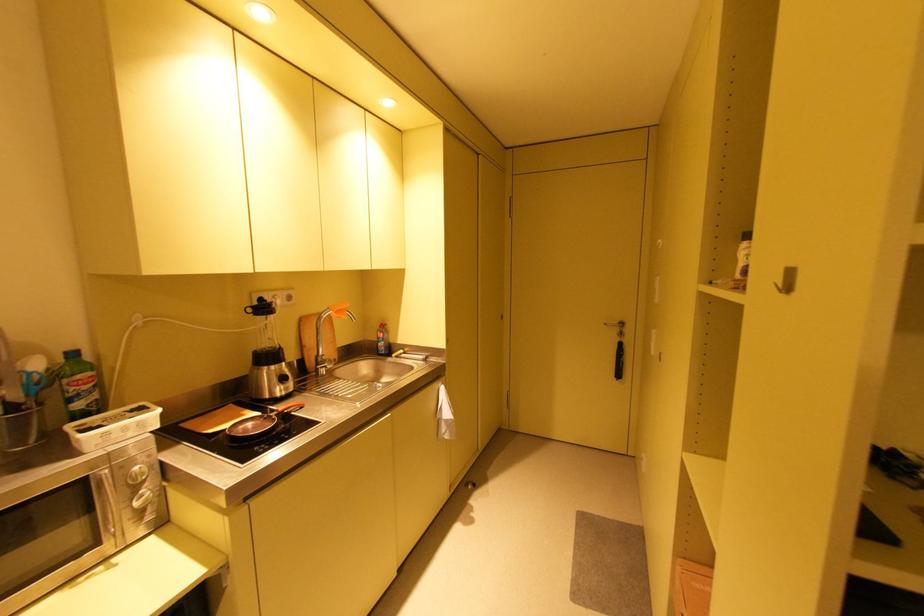
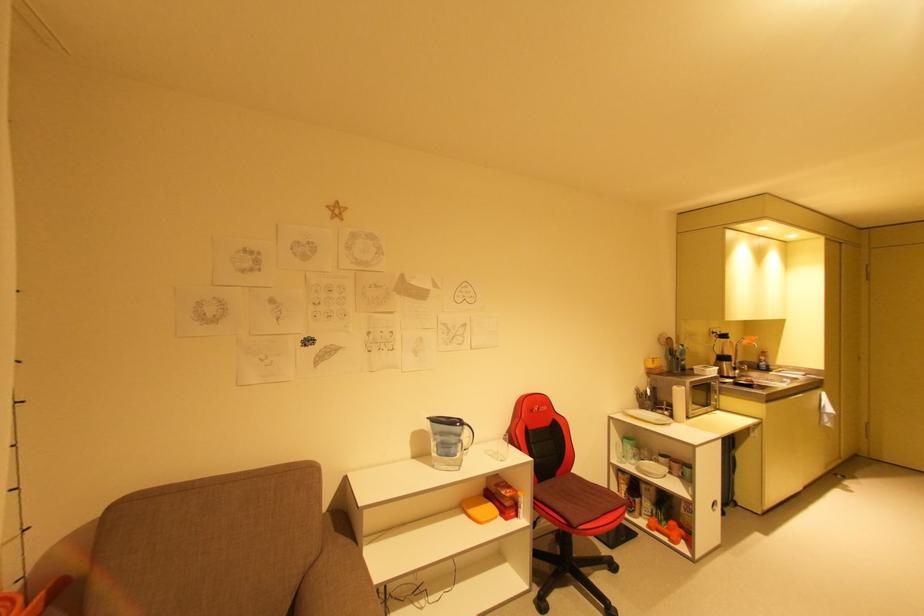
In the second image, find the point that corresponds to [342,312] in the first image.

(756, 341)